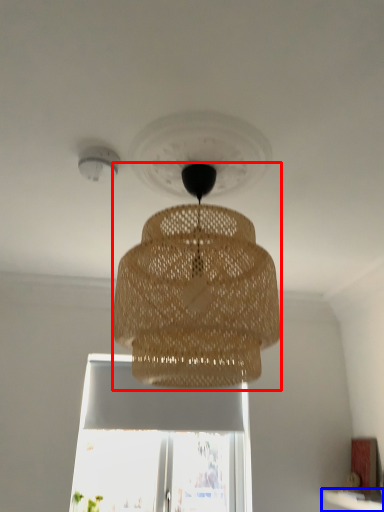
Question: Which point is closer to the camera, lamp (highlighted by a red box) or window sill (highlighted by a blue box)?

Choices:
 (A) lamp
 (B) window sill

Answer: (A)